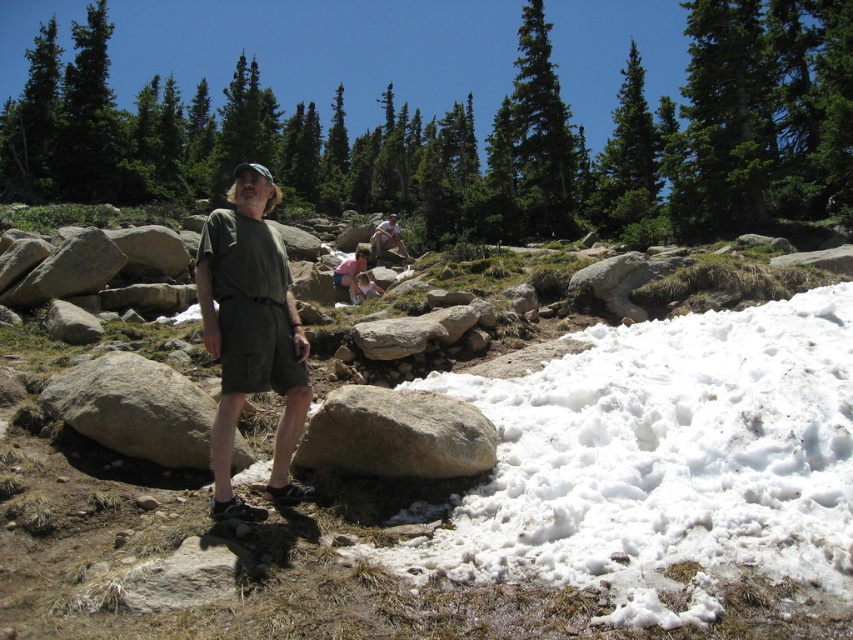
Between white fluffy snow at lower right and matte green shirt at upper center, which one has less height?

With less height is white fluffy snow at lower right.

Between white fluffy snow at lower right and matte green shirt at upper center, which one is positioned higher?

matte green shirt at upper center is above.

What do you see at coordinates (660, 461) in the screenshot? I see `white fluffy snow at lower right` at bounding box center [660, 461].

You are a GUI agent. You are given a task and a screenshot of the screen. Output one action in this format:
    pyautogui.click(x=<x>, y=<y>)
    Task: Click on the white fluffy snow at lower right
    
    Given the screenshot: What is the action you would take?
    pyautogui.click(x=660, y=461)

Is brown rock at center in front of gray rock at center?

Yes.

Is point (635, 340) farther from viewer compared to point (134, 419)?

Yes.

Locate an element on the screen. brown rock at center is located at coordinates (440, 493).

Does gray rough boulder at center appear under gray rock at center?

Yes, gray rough boulder at center is below gray rock at center.

Can you confirm if gray rough boulder at center is taller than gray rock at center?

No, gray rough boulder at center is not taller than gray rock at center.

Does point (381, 464) lie behind point (190, 465)?

No, it is not.

Locate an element on the screen. The image size is (853, 640). gray rough boulder at center is located at coordinates (396, 435).